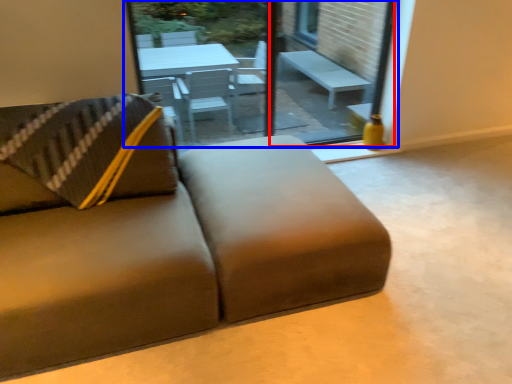
Question: Among these objects, which one is nearest to the camera, window screen (highlighted by a red box) or window (highlighted by a blue box)?

Choices:
 (A) window screen
 (B) window

Answer: (B)